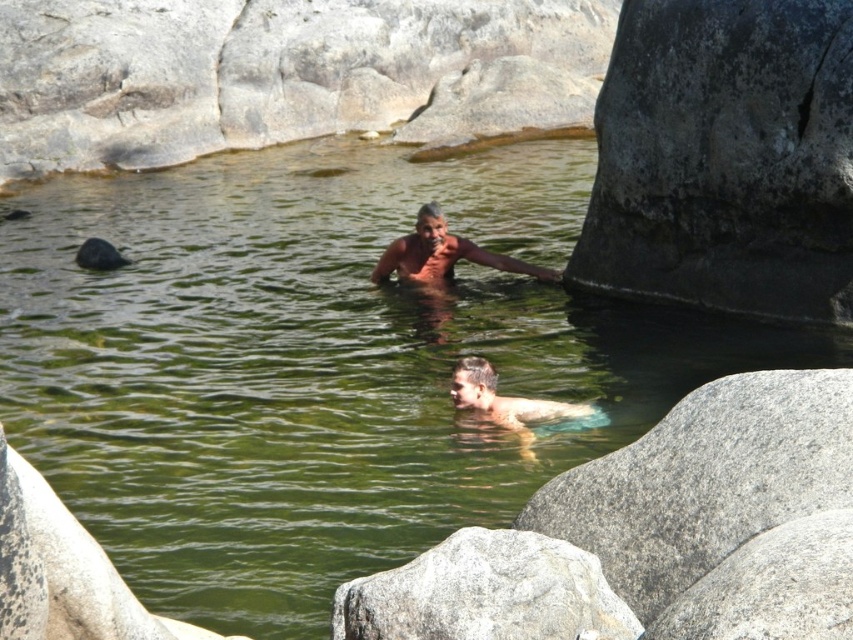
You are a photographer trying to capture a closeup of the gray rough rock at lower center and the smooth skin man at center. Since the rock is smaller than the man, which object should you zoom in more on to make both appear equally sized in the photo?

Since the gray rough rock at lower center is smaller than the smooth skin man at center, you should zoom in more on the gray rough rock at lower center to make both appear equally sized in the photo.

Looking at this image, you are a photographer planning to take a photo of the smooth skin man at center and the gray rough rock at lower right. If you want to ensure both subjects are fully visible in the frame, which object should you position closer to the camera?

The gray rough rock at lower right might be wider than smooth skin man at center, so you should position the gray rough rock at lower right closer to the camera to ensure both are fully visible.

You are standing at the edge of the natural pool and want to reach the smooth skin man at center without stepping on the gray rough rock at lower center. Which direction should you move to avoid it?

The gray rough rock at lower center is to the left of the smooth skin man at center, so you should move to the right to avoid stepping on the rock while approaching the smooth skin man at center.